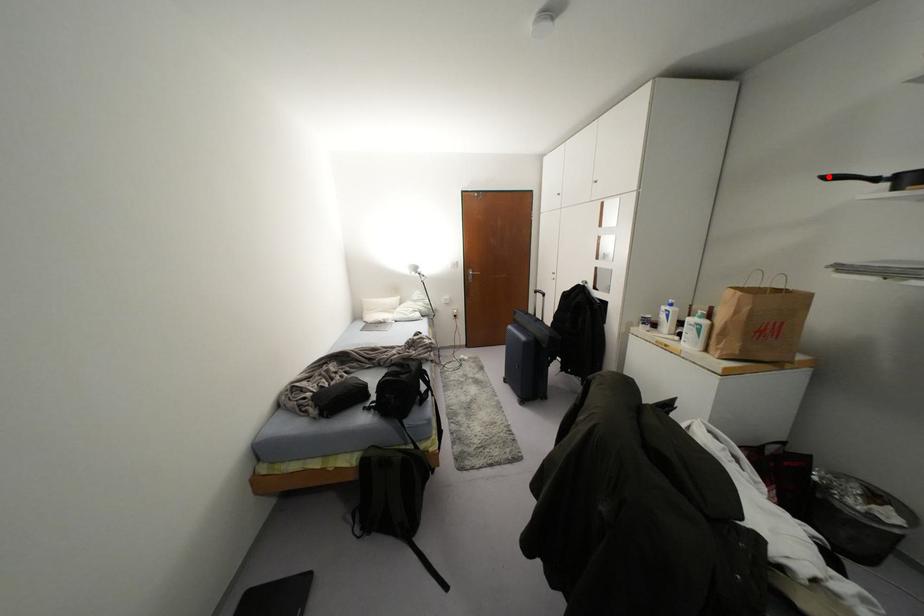
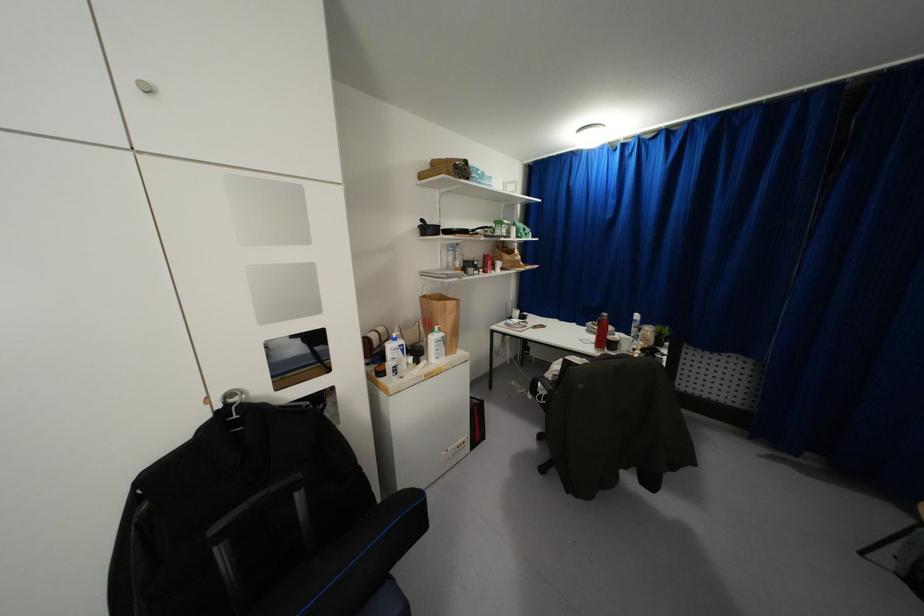
Question: I am providing you with two images of the same scene from different viewpoints. Image1 has a red point marked. In image2, the corresponding 3D location appears at what relative position? Reply with the corresponding letter.

Choices:
 (A) Closer
 (B) Farther

Answer: (A)